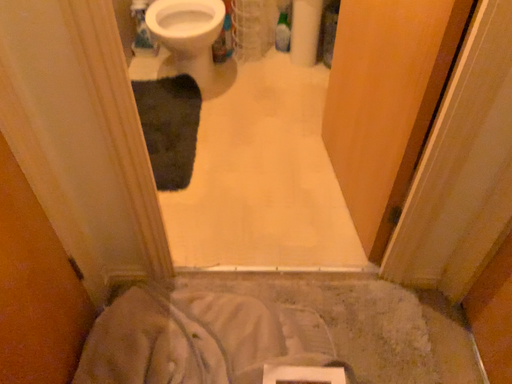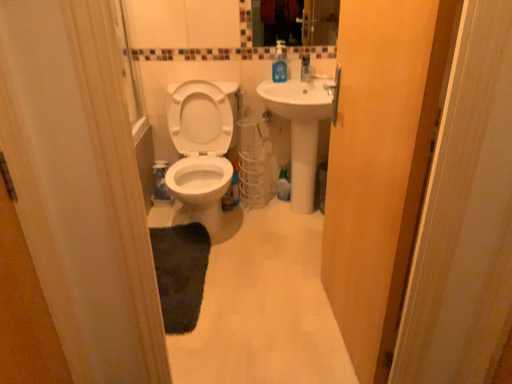
Question: How did the camera likely rotate when shooting the video?

Choices:
 (A) rotated downward
 (B) rotated upward

Answer: (B)